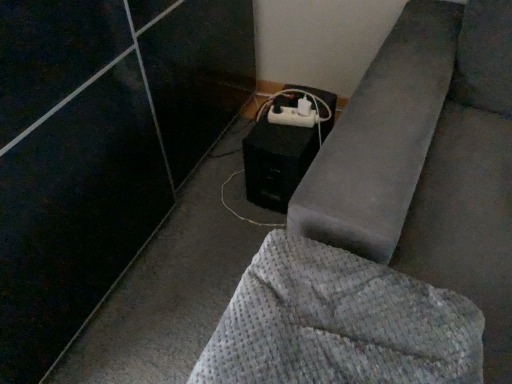
Question: Is black matte speaker at lower center outside of white plastic extension cord at lower center?

Choices:
 (A) no
 (B) yes

Answer: (B)

Question: Is black matte speaker at lower center smaller than white plastic extension cord at lower center?

Choices:
 (A) yes
 (B) no

Answer: (B)

Question: From the image's perspective, is black matte speaker at lower center over white plastic extension cord at lower center?

Choices:
 (A) no
 (B) yes

Answer: (A)

Question: Does black matte speaker at lower center touch white plastic extension cord at lower center?

Choices:
 (A) yes
 (B) no

Answer: (B)

Question: Is black matte speaker at lower center thinner than white plastic extension cord at lower center?

Choices:
 (A) no
 (B) yes

Answer: (A)

Question: From a real-world perspective, is black matte speaker at lower center physically located above or below waffle-textured gray blanket at lower right?

Choices:
 (A) below
 (B) above

Answer: (A)

Question: Do you think black matte speaker at lower center is within waffle-textured gray blanket at lower right, or outside of it?

Choices:
 (A) outside
 (B) inside

Answer: (A)

Question: In terms of size, does black matte speaker at lower center appear bigger or smaller than waffle-textured gray blanket at lower right?

Choices:
 (A) big
 (B) small

Answer: (A)

Question: Is black matte speaker at lower center to the left or to the right of waffle-textured gray blanket at lower right in the image?

Choices:
 (A) right
 (B) left

Answer: (B)

Question: Considering the positions of black matte speaker at lower center and white plastic extension cord at lower center in the image, is black matte speaker at lower center bigger or smaller than white plastic extension cord at lower center?

Choices:
 (A) big
 (B) small

Answer: (A)

Question: In the image, is black matte speaker at lower center positioned in front of or behind white plastic extension cord at lower center?

Choices:
 (A) front
 (B) behind

Answer: (A)

Question: Is point (252, 198) closer or farther from the camera than point (289, 120)?

Choices:
 (A) closer
 (B) farther

Answer: (B)

Question: From the image's perspective, is black matte speaker at lower center positioned above or below white plastic extension cord at lower center?

Choices:
 (A) below
 (B) above

Answer: (A)

Question: From the image's perspective, is waffle-textured gray blanket at lower right located above or below black matte speaker at lower center?

Choices:
 (A) below
 (B) above

Answer: (A)

Question: Which is correct: waffle-textured gray blanket at lower right is inside black matte speaker at lower center, or outside of it?

Choices:
 (A) inside
 (B) outside

Answer: (B)